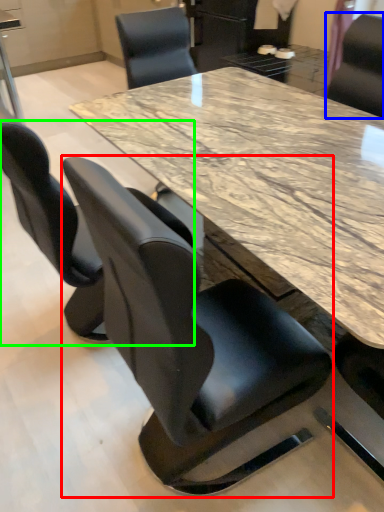
Question: Which object is the farthest from chair (highlighted by a red box)? Choose among these: chair (highlighted by a blue box) or chair (highlighted by a green box).

Choices:
 (A) chair
 (B) chair

Answer: (A)